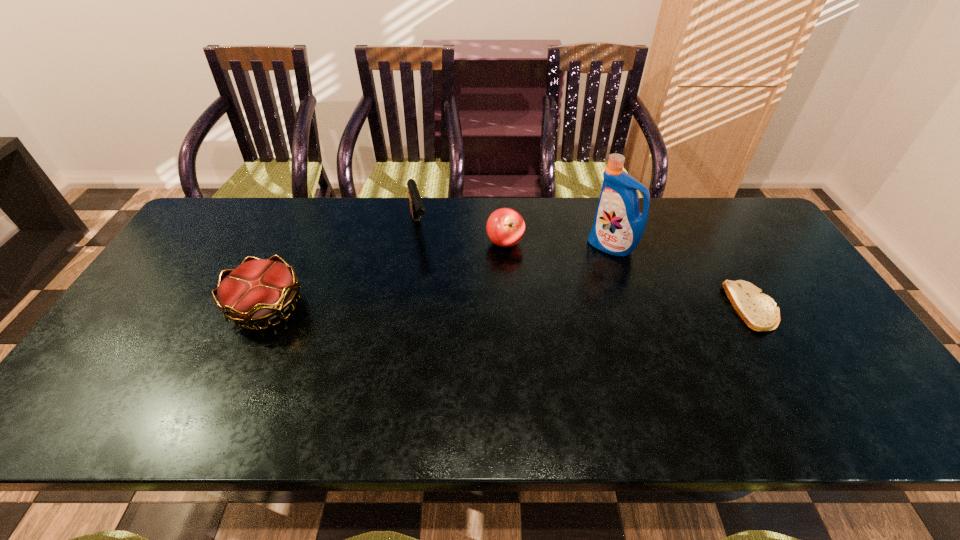
Where is `free point located 0.230m on the label of the tallest object`? The height and width of the screenshot is (540, 960). free point located 0.230m on the label of the tallest object is located at coordinates (545, 292).

The width and height of the screenshot is (960, 540). I want to click on vacant space situated on the label of the tallest object, so click(555, 285).

Where is `vacant space located on the label of the tallest object`? Image resolution: width=960 pixels, height=540 pixels. vacant space located on the label of the tallest object is located at coordinates (560, 281).

You are a GUI agent. You are given a task and a screenshot of the screen. Output one action in this format:
    pyautogui.click(x=<x>, y=<y>)
    Task: Click on the free space located 0.180m on the stem of the apple
    The image size is (960, 540).
    Given the screenshot: What is the action you would take?
    pyautogui.click(x=476, y=295)

This screenshot has width=960, height=540. What are the coordinates of `vacant area situated on the stem of the apple` in the screenshot? It's located at (489, 272).

The image size is (960, 540). I want to click on vacant region located on the stem of the apple, so click(x=462, y=321).

Find the location of a particular element. free space located 0.060m at the barrel of the second object from left to right is located at coordinates (424, 256).

Locate an element on the screen. free location located 0.350m at the barrel of the second object from left to right is located at coordinates (447, 329).

This screenshot has height=540, width=960. I want to click on vacant space located 0.210m at the barrel of the second object from left to right, so click(x=435, y=291).

At what (x,y) coordinates should I click in order to perform the action: click on detergent that is positioned at the far edge. Please return your answer as a coordinate pair (x, y). This screenshot has width=960, height=540. Looking at the image, I should click on (618, 227).